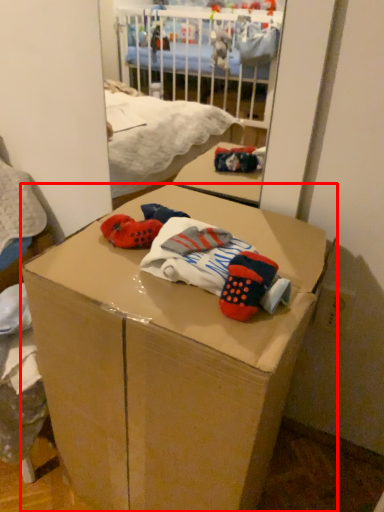
Question: From the image's perspective, where is box (annotated by the red box) located in relation to baby clothe in the image?

Choices:
 (A) above
 (B) below

Answer: (B)